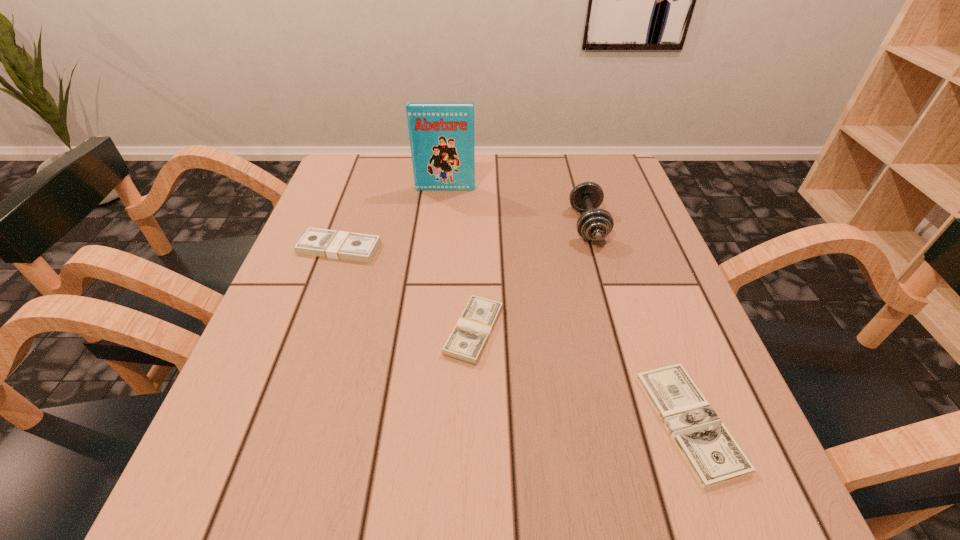
Where is `the tallest object`? the tallest object is located at coordinates (441, 134).

This screenshot has height=540, width=960. I want to click on book, so click(441, 134).

Locate an element on the screen. the fourth shortest object is located at coordinates (594, 224).

Find the location of a particular element. This screenshot has width=960, height=540. the leftmost dollar is located at coordinates (342, 245).

Where is `the leftmost object`? the leftmost object is located at coordinates (342, 245).

The width and height of the screenshot is (960, 540). In order to click on the second nearest object in this screenshot , I will do `click(469, 337)`.

This screenshot has height=540, width=960. What are the coordinates of `the second dollar from right to left` in the screenshot? It's located at (469, 337).

What are the coordinates of `the rightmost dollar` in the screenshot? It's located at (713, 455).

In order to click on the shortest dollar in this screenshot , I will do `click(713, 455)`.

Identify the location of vacant area situated on the front cover of the farthest object. This screenshot has width=960, height=540. (441, 235).